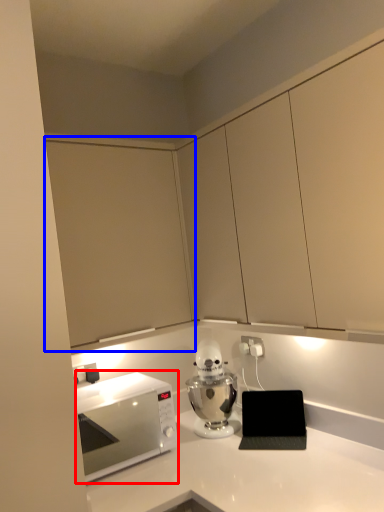
Question: Which object appears closest to the camera in this image, microwave oven (highlighted by a red box) or cabinetry (highlighted by a blue box)?

Choices:
 (A) microwave oven
 (B) cabinetry

Answer: (A)